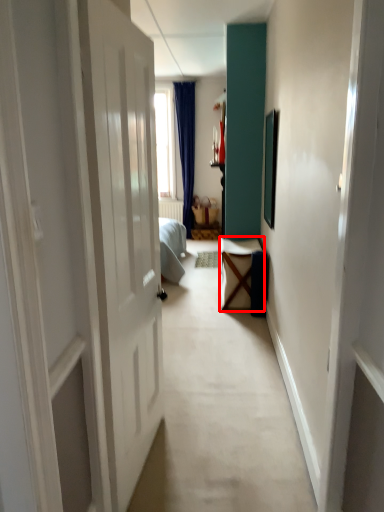
Question: From the image's perspective, what is the correct spatial relationship of furniture (annotated by the red box) in relation to furniture?

Choices:
 (A) below
 (B) above

Answer: (A)